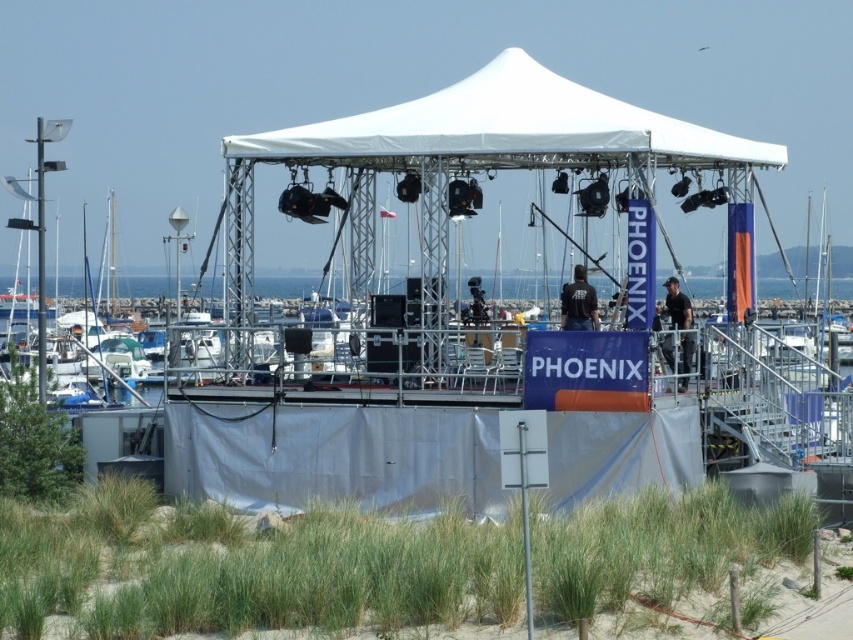
Question: Is white fabric canopy at center below blue water at center?

Choices:
 (A) no
 (B) yes

Answer: (A)

Question: Which object appears farthest from the camera in this image?

Choices:
 (A) blue water at center
 (B) white fabric canopy at center

Answer: (A)

Question: Does white fabric canopy at center appear on the left side of blue water at center?

Choices:
 (A) no
 (B) yes

Answer: (A)

Question: From the image, what is the correct spatial relationship of white fabric canopy at center in relation to blue water at center?

Choices:
 (A) left
 (B) right

Answer: (B)